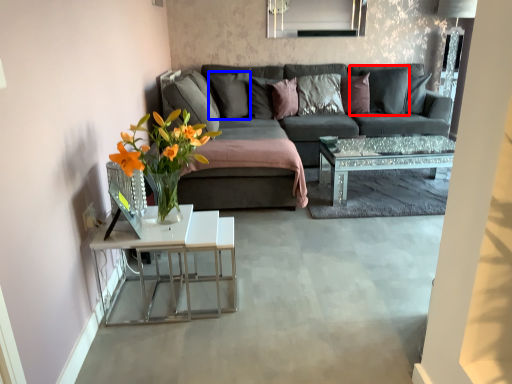
Question: Which object is closer to the camera taking this photo, pillow (highlighted by a red box) or pillow (highlighted by a blue box)?

Choices:
 (A) pillow
 (B) pillow

Answer: (B)